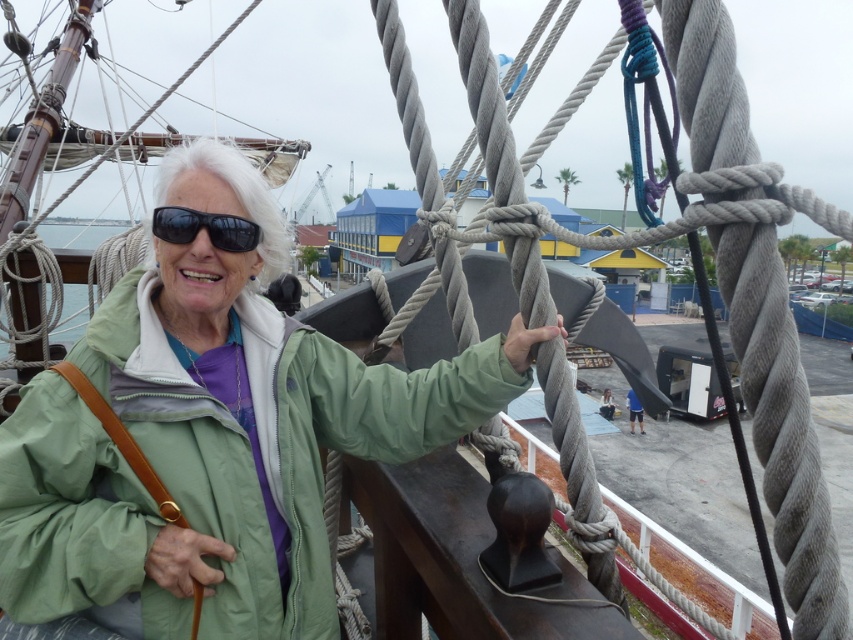
You are a photographer standing on the deck of the ship. You want to take a photo of the green matte jacket at center and the black matte sunglasses at upper left. If your camera can focus on objects within a 50 cm range, will both items be in focus at the same time?

The distance between the green matte jacket at center and the black matte sunglasses at upper left is 46.06 centimeters. Since this is within the 50 cm range, both items can be in focus simultaneously.

You are a photographer on the ship deck. You want to take a photo of the elderly woman wearing the green matte jacket at center and the black matte sunglasses at upper left. However, your camera can only focus on one object at a time. Which object should you focus on first to ensure it appears larger in the photo?

The green matte jacket at center should be focused on first because it is closer to the viewer than the black matte sunglasses at upper left, making it appear larger in the photo.